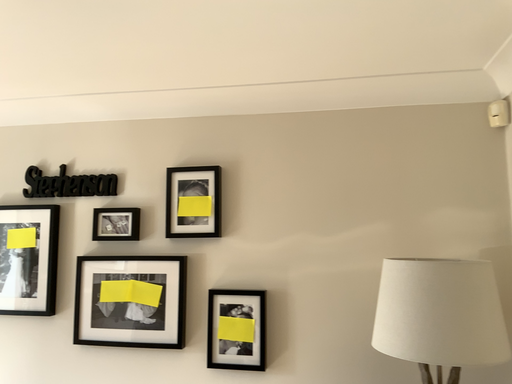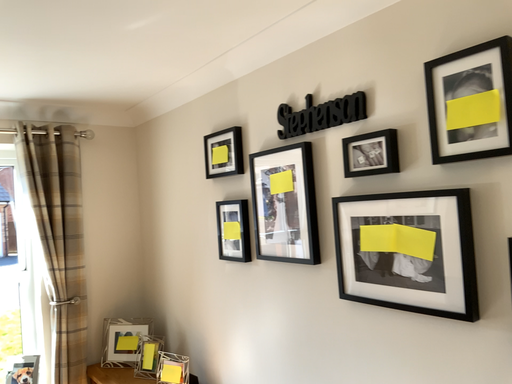
Question: Which way did the camera rotate in the video?

Choices:
 (A) rotated right
 (B) rotated left

Answer: (B)